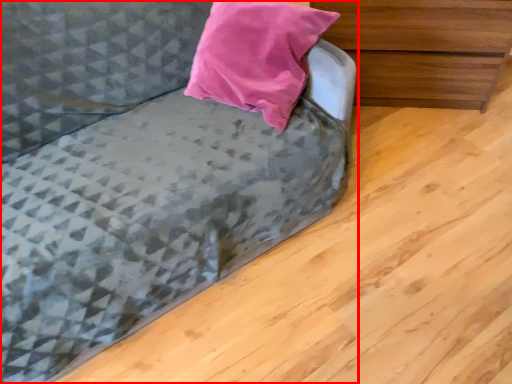
Question: Where is studio couch (annotated by the red box) located in relation to chest of drawers in the image?

Choices:
 (A) right
 (B) left

Answer: (B)